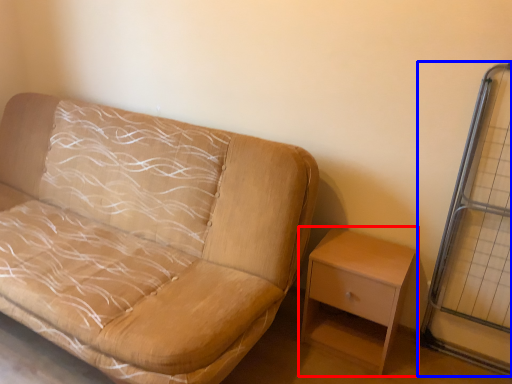
Question: Among these objects, which one is farthest to the camera, nightstand (highlighted by a red box) or glass door (highlighted by a blue box)?

Choices:
 (A) nightstand
 (B) glass door

Answer: (A)